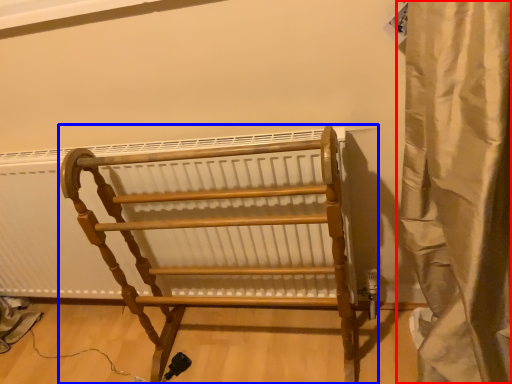
Question: Which point is further to the camera, curtain (highlighted by a red box) or furniture (highlighted by a blue box)?

Choices:
 (A) curtain
 (B) furniture

Answer: (B)